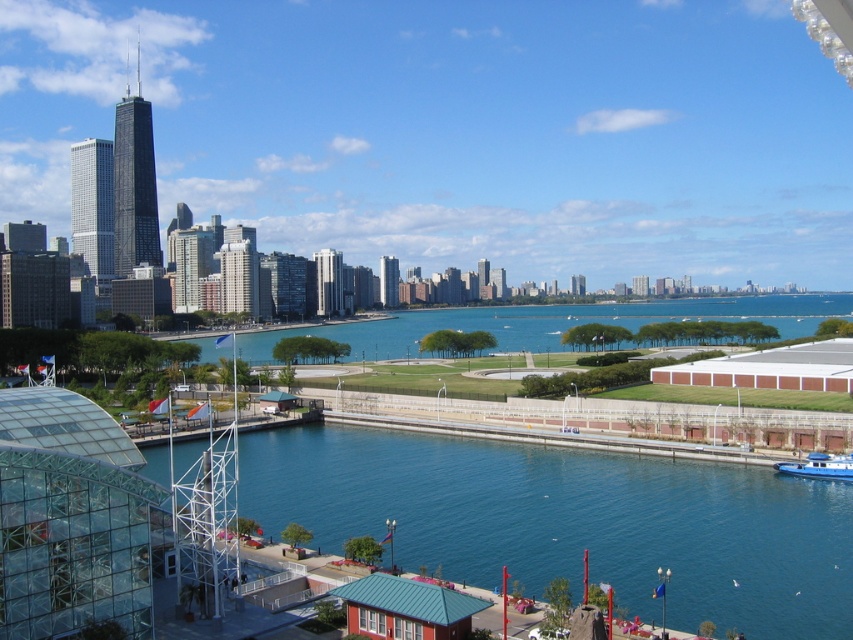
You are standing at the point labeled as point (570, 522) in the cityscape image. What can you see directly in front of you?

You can see blue glassy water at lower center directly in front of you at point (570, 522).

You are a photographer planning to take a photo of the blue water at center and the blue matte boat at lower right. Based on their positions, which object appears closer to the camera in the image?

The blue water at center appears closer to the camera because it is taller than the blue matte boat at lower right, indicating it occupies more space in the foreground.

You are planning to take a photo of the blue water at center and the blue matte boat at lower right. Which object should you focus on first if you want to include both in your shot without moving the camera?

The blue water at center is larger in size than the blue matte boat at lower right, so you should focus on the blue water at center first to ensure it fits properly in the frame before adjusting for the smaller boat.